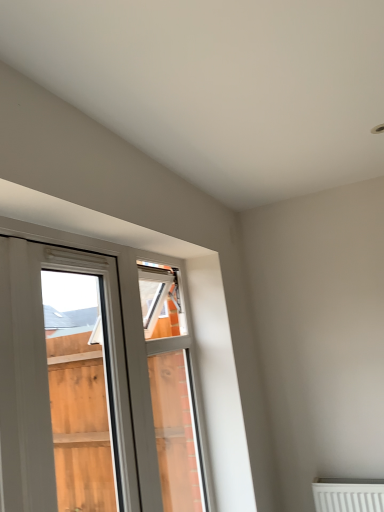
What is the approximate width of white plastic window at left?

It is 4.58 inches.

The width and height of the screenshot is (384, 512). Describe the element at coordinates (94, 385) in the screenshot. I see `white plastic window at left` at that location.

Find the location of a particular element. The image size is (384, 512). white plastic window at left is located at coordinates (94, 385).

The width and height of the screenshot is (384, 512). What do you see at coordinates (172, 389) in the screenshot?
I see `white plastic window frame at center` at bounding box center [172, 389].

The width and height of the screenshot is (384, 512). I want to click on white plastic window frame at center, so click(x=172, y=389).

This screenshot has height=512, width=384. Identify the location of white plastic window at left. (94, 385).

Considering the positions of objects white plastic window at left and white plastic window frame at center in the image provided, who is more to the right, white plastic window at left or white plastic window frame at center?

white plastic window frame at center.

Is the position of white plastic window at left more distant than that of white plastic window frame at center?

No, white plastic window at left is in front of white plastic window frame at center.

Is point (0, 328) closer or farther from the camera than point (185, 347)?

Point (0, 328) is positioned closer to the camera compared to point (185, 347).

From the image's perspective, is white plastic window at left located above or below white plastic window frame at center?

Clearly, from the image's perspective, white plastic window at left is above white plastic window frame at center.

From a real-world perspective, who is located lower, white plastic window at left or white plastic window frame at center?

In real-world perspective, white plastic window frame at center is lower.

Does white plastic window at left have a lesser width compared to white plastic window frame at center?

Yes.

Who is shorter, white plastic window at left or white plastic window frame at center?

With less height is white plastic window at left.

Is white plastic window at left bigger than white plastic window frame at center?

No, white plastic window at left is not bigger than white plastic window frame at center.

Is white plastic window frame at center inside white plastic window at left?

No, white plastic window frame at center is not inside white plastic window at left.

Is white plastic window at left in contact with white plastic window frame at center?

white plastic window at left and white plastic window frame at center are not in contact.

In the scene shown: Is white plastic window at left oriented towards white plastic window frame at center?

No, white plastic window at left is not oriented towards white plastic window frame at center.

The height and width of the screenshot is (512, 384). What are the coordinates of `window frame below the white plastic window at left (from a real-world perspective)` in the screenshot? It's located at (172, 389).

In the image, is white plastic window frame at center on the left side or the right side of white plastic window at left?

From the image, it's evident that white plastic window frame at center is to the right of white plastic window at left.

Does white plastic window frame at center come behind white plastic window at left?

That is True.

Is point (200, 451) closer or farther from the camera than point (16, 392)?

Point (200, 451) is farther from the camera than point (16, 392).

From the image's perspective, between white plastic window frame at center and white plastic window at left, who is located below?

white plastic window frame at center, from the image's perspective.

From a real-world perspective, is white plastic window frame at center below white plastic window at left?

Yes, from a real-world perspective, white plastic window frame at center is beneath white plastic window at left.

Is white plastic window frame at center wider or thinner than white plastic window at left?

white plastic window frame at center is wider than white plastic window at left.

Considering the sizes of objects white plastic window frame at center and white plastic window at left in the image provided, who is shorter, white plastic window frame at center or white plastic window at left?

white plastic window at left.

Does white plastic window frame at center have a smaller size compared to white plastic window at left?

Actually, white plastic window frame at center might be larger than white plastic window at left.

Would you say white plastic window frame at center is inside or outside white plastic window at left?

white plastic window frame at center is located beyond the bounds of white plastic window at left.

Is the surface of white plastic window frame at center in direct contact with white plastic window at left?

white plastic window frame at center and white plastic window at left are clearly separated.

Is white plastic window frame at center oriented towards white plastic window at left?

No, white plastic window frame at center is not facing towards white plastic window at left.

Measure the distance between white plastic window frame at center and white plastic window at left.

white plastic window frame at center and white plastic window at left are 10.89 centimeters apart from each other.

Find the location of `window in front of the white plastic window frame at center`. window in front of the white plastic window frame at center is located at coordinates [x=94, y=385].

Identify the location of window above the white plastic window frame at center (from the image's perspective). (94, 385).

The width and height of the screenshot is (384, 512). Find the location of `window frame that appears on the right of white plastic window at left`. window frame that appears on the right of white plastic window at left is located at coordinates (172, 389).